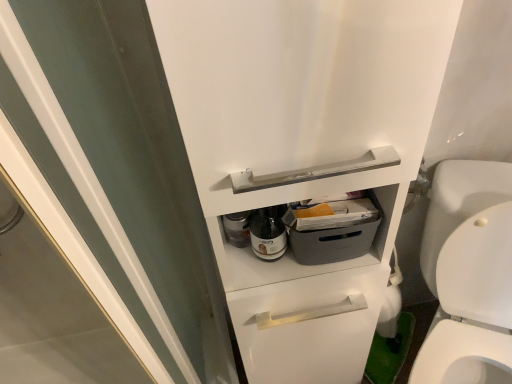
Question: Can you confirm if white glossy toilet at right is positioned to the left of translucent glass bottle at center?

Choices:
 (A) yes
 (B) no

Answer: (B)

Question: Is white glossy toilet at right not near translucent glass bottle at center?

Choices:
 (A) yes
 (B) no

Answer: (B)

Question: Is translucent glass bottle at center a part of white glossy toilet at right?

Choices:
 (A) no
 (B) yes

Answer: (A)

Question: Considering the relative sizes of white glossy toilet at right and translucent glass bottle at center in the image provided, is white glossy toilet at right thinner than translucent glass bottle at center?

Choices:
 (A) yes
 (B) no

Answer: (B)

Question: Is white glossy toilet at right oriented towards translucent glass bottle at center?

Choices:
 (A) yes
 (B) no

Answer: (B)

Question: From a real-world perspective, does white glossy toilet at right sit lower than translucent glass bottle at center?

Choices:
 (A) yes
 (B) no

Answer: (A)

Question: Does translucent glass bottle at center appear on the right side of white glossy toilet at right?

Choices:
 (A) yes
 (B) no

Answer: (B)

Question: Does translucent glass bottle at center turn towards white glossy toilet at right?

Choices:
 (A) no
 (B) yes

Answer: (A)

Question: Can you confirm if translucent glass bottle at center is taller than white glossy toilet at right?

Choices:
 (A) no
 (B) yes

Answer: (A)

Question: Considering the relative sizes of translucent glass bottle at center and white glossy toilet at right in the image provided, is translucent glass bottle at center bigger than white glossy toilet at right?

Choices:
 (A) yes
 (B) no

Answer: (B)

Question: Does translucent glass bottle at center have a greater width compared to white glossy toilet at right?

Choices:
 (A) no
 (B) yes

Answer: (A)

Question: Is translucent glass bottle at center closer to camera compared to white glossy toilet at right?

Choices:
 (A) yes
 (B) no

Answer: (B)

Question: Can you confirm if white glossy toilet at right is taller than transparent glass screen door at upper left?

Choices:
 (A) yes
 (B) no

Answer: (B)